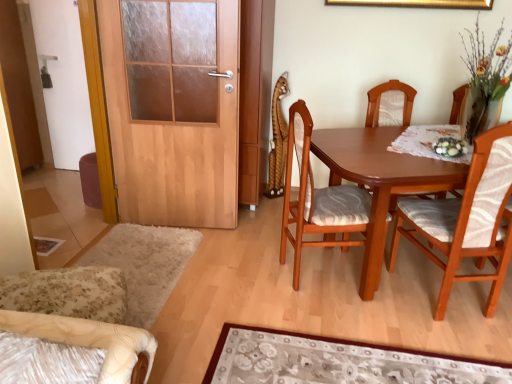
Find the location of a particular element. The image size is (512, 384). vacant space situated on the left part of wooden chair with patterned cushion at center, the second chair from the left is located at coordinates (255, 273).